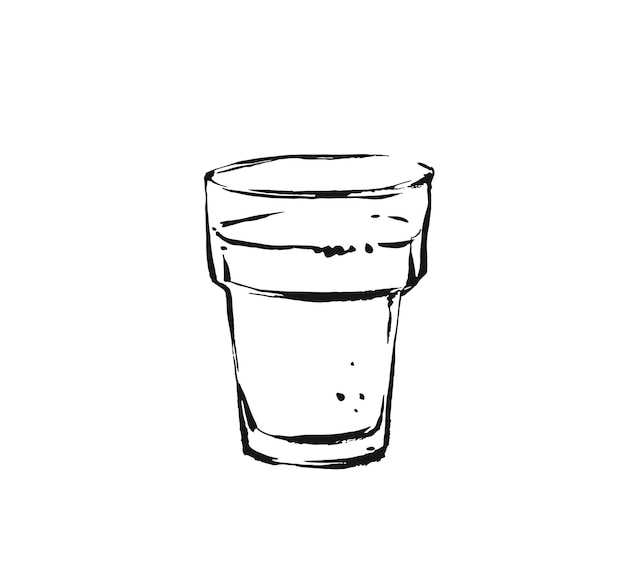
Find the location of a particular element. The height and width of the screenshot is (579, 626). top of the liquid in the cup is located at coordinates pyautogui.click(x=307, y=245).